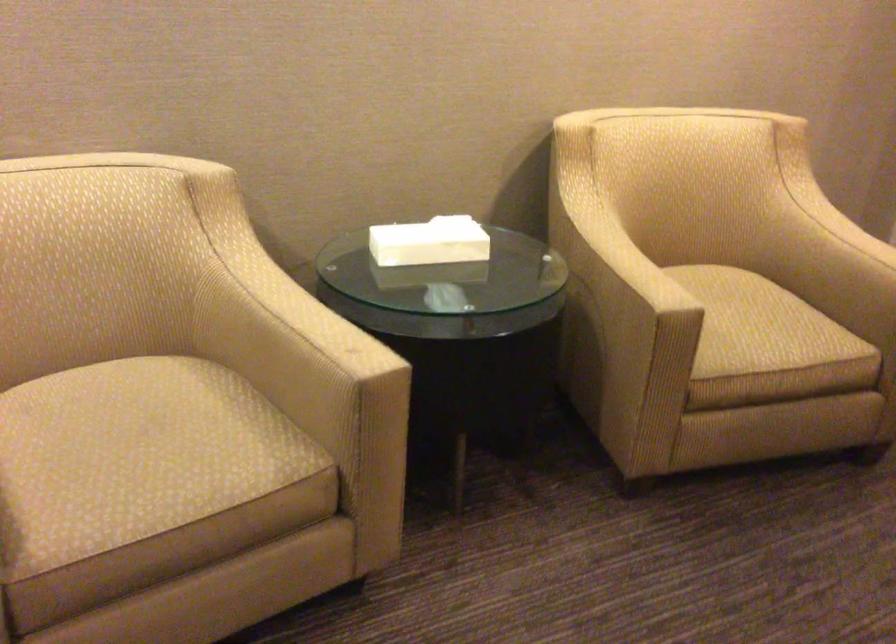
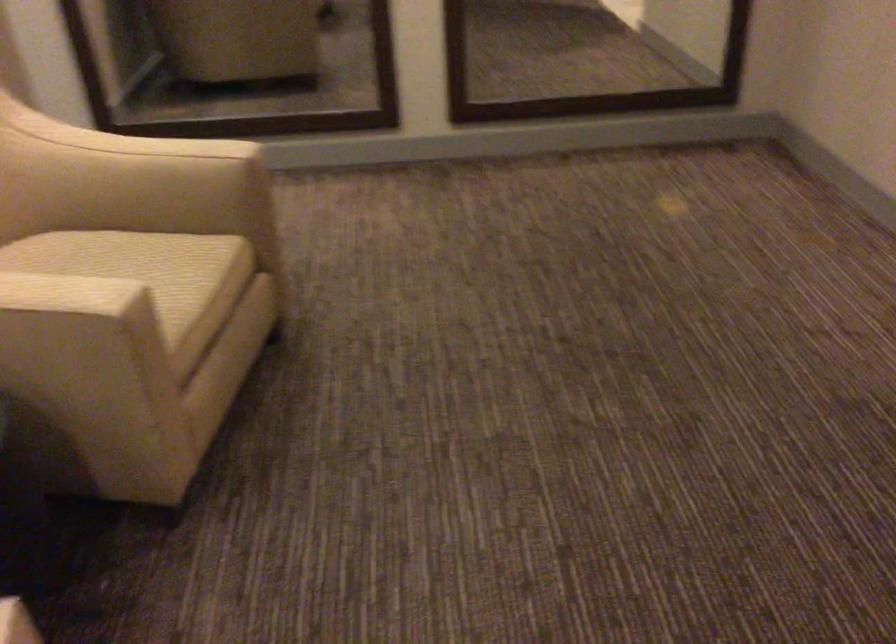
The point at (769, 319) is marked in the first image. Where is the corresponding point in the second image?

(143, 268)